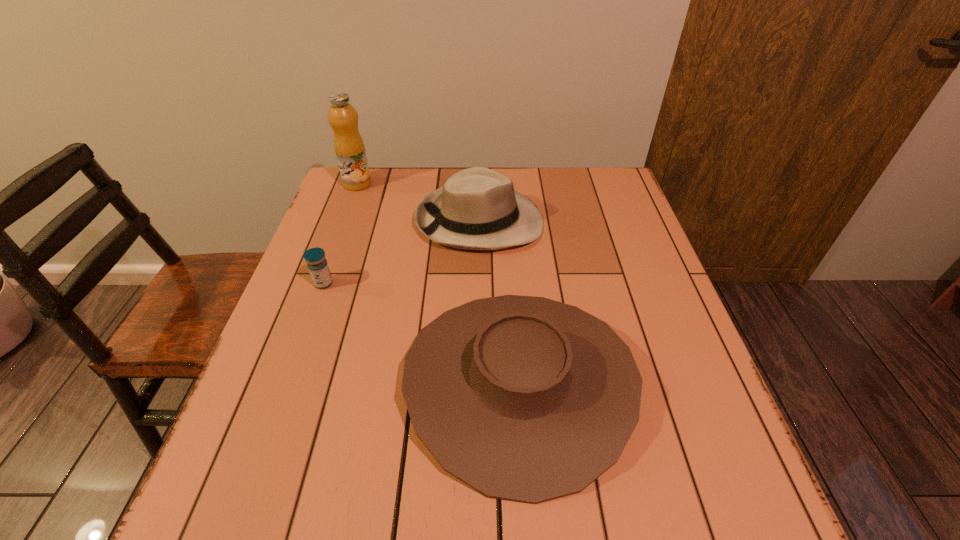
Where is `fruit juice located in the far edge section of the desktop`? fruit juice located in the far edge section of the desktop is located at coordinates (349, 147).

The width and height of the screenshot is (960, 540). In order to click on fedora at the far edge in this screenshot , I will do click(x=478, y=209).

Where is `object at the near edge`? The height and width of the screenshot is (540, 960). object at the near edge is located at coordinates (527, 399).

The width and height of the screenshot is (960, 540). I want to click on fruit juice at the left edge, so click(x=349, y=147).

At what (x,y) coordinates should I click in order to perform the action: click on medicine that is at the left edge. Please return your answer as a coordinate pair (x, y). Looking at the image, I should click on (317, 264).

I want to click on object that is at the right edge, so click(527, 399).

Where is `object that is at the far left corner`? This screenshot has height=540, width=960. object that is at the far left corner is located at coordinates (349, 147).

This screenshot has height=540, width=960. I want to click on object that is at the near right corner, so click(x=527, y=399).

You are a GUI agent. You are given a task and a screenshot of the screen. Output one action in this format:
    pyautogui.click(x=<x>, y=<y>)
    Task: Click on the vacant space at the far edge of the desktop
    Image resolution: width=960 pixels, height=540 pixels.
    Given the screenshot: What is the action you would take?
    pyautogui.click(x=385, y=210)

At what (x,y) coordinates should I click in order to perform the action: click on vacant space at the near edge. Please return your answer as a coordinate pair (x, y). The image size is (960, 540). Looking at the image, I should click on (481, 521).